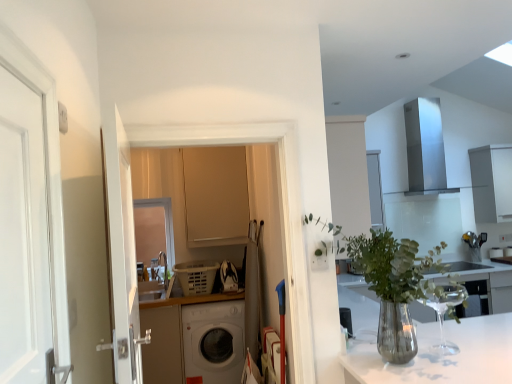
Question: From a real-world perspective, is matte beige cabinet at center, which is counted as the first cabinetry, starting from the left, above or below white glossy sink at center?

Choices:
 (A) below
 (B) above

Answer: (B)

Question: In terms of size, does matte beige cabinet at center, which is the second cabinetry from back to front, appear bigger or smaller than white glossy sink at center?

Choices:
 (A) big
 (B) small

Answer: (A)

Question: Based on their relative distances, which object is farther from the white glossy sink at center?

Choices:
 (A) matte beige cabinet at center, marked as the 2th cabinetry in a right-to-left arrangement
 (B) white matte cabinet at upper right, which is the second cabinetry from front to back
 (C) translucent glass vase at center
 (D) white matte washing machine at center

Answer: (C)

Question: Estimate the real-world distances between objects in this image. Which object is farther from the white matte cabinet at upper right, which is counted as the 1th cabinetry, starting from the back?

Choices:
 (A) matte beige cabinet at center, which is counted as the first cabinetry, starting from the left
 (B) translucent glass vase at center
 (C) white matte washing machine at center
 (D) white glossy sink at center

Answer: (B)